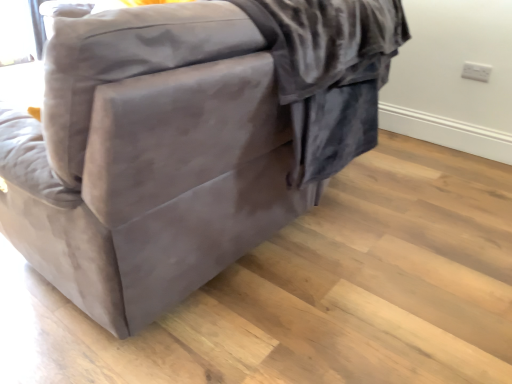
What do you see at coordinates (149, 158) in the screenshot? The height and width of the screenshot is (384, 512). I see `velvet gray chair at center` at bounding box center [149, 158].

You are a GUI agent. You are given a task and a screenshot of the screen. Output one action in this format:
    pyautogui.click(x=<x>, y=<y>)
    Task: Click on the velvet gray chair at center
    The width and height of the screenshot is (512, 384).
    Given the screenshot: What is the action you would take?
    pyautogui.click(x=149, y=158)

Locate an element on the screen. This screenshot has width=512, height=384. velvet gray chair at center is located at coordinates (149, 158).